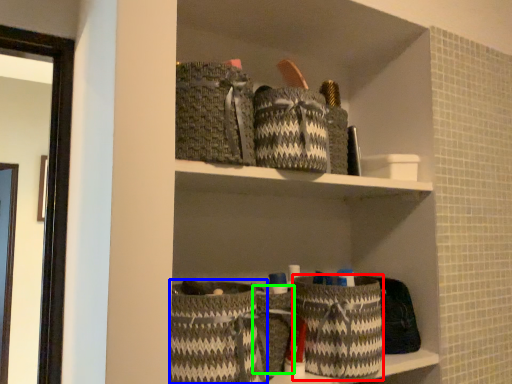
Question: Which is nearer to the basket (highlighted by a red box)? basket (highlighted by a blue box) or basket (highlighted by a green box).

Choices:
 (A) basket
 (B) basket

Answer: (B)